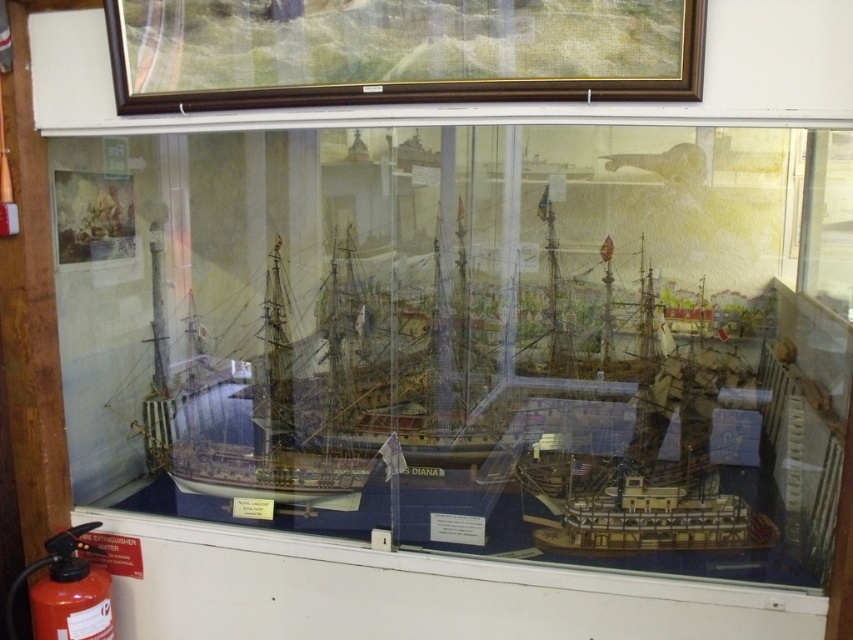
Question: Does wooden frame at upper center have a greater width compared to white wooden ship at center?

Choices:
 (A) no
 (B) yes

Answer: (B)

Question: Which of the following is the closest to the observer?

Choices:
 (A) (599, 58)
 (B) (107, 605)

Answer: (A)

Question: Which object appears closest to the camera in this image?

Choices:
 (A) white wooden ship at center
 (B) wooden frame at upper center
 (C) red matte fire extinguisher at lower left

Answer: (B)

Question: Is white wooden ship at center wider than red matte fire extinguisher at lower left?

Choices:
 (A) no
 (B) yes

Answer: (B)

Question: Does wooden frame at upper center have a smaller size compared to red matte fire extinguisher at lower left?

Choices:
 (A) yes
 (B) no

Answer: (B)

Question: Which of the following is the farthest from the observer?

Choices:
 (A) white wooden ship at center
 (B) wooden frame at upper center
 (C) red matte fire extinguisher at lower left

Answer: (A)